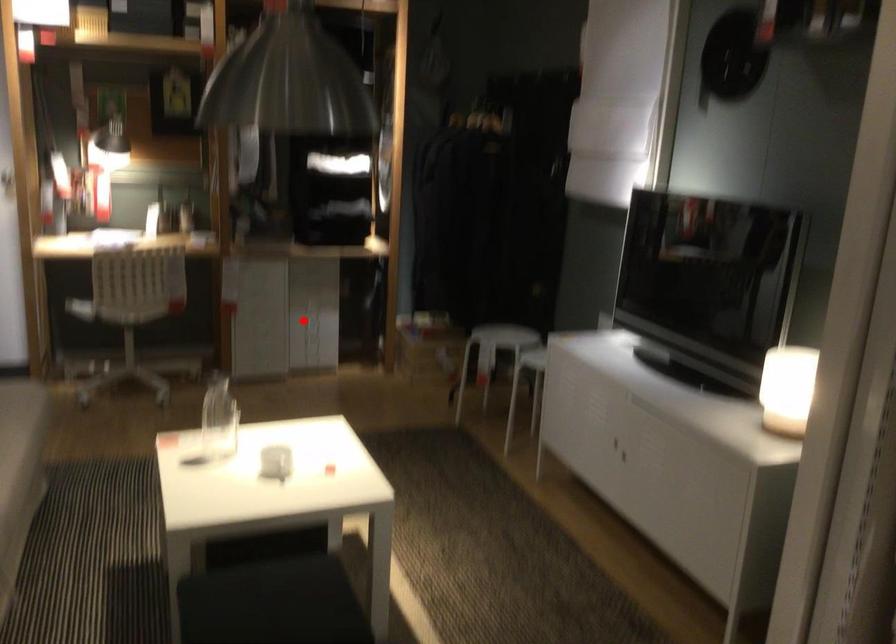
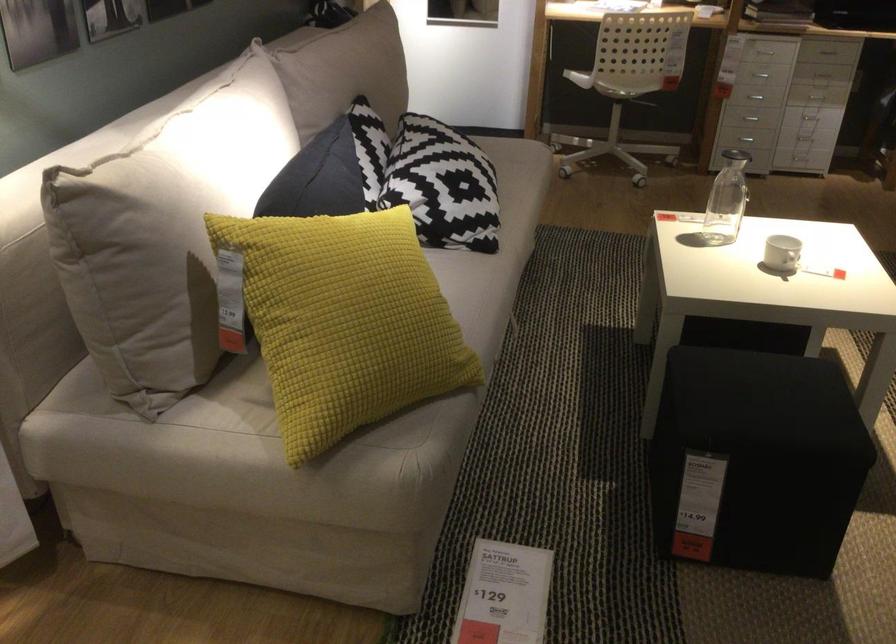
The point at the highlighted location is marked in the first image. Where is the corresponding point in the second image?

(815, 96)